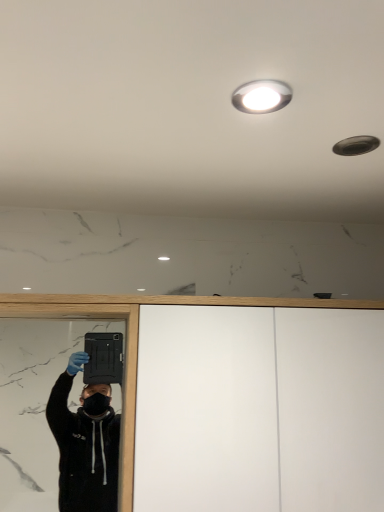
Question: From a real-world perspective, relative to white glossy droplight at upper center, is white matte dresser at center vertically above or below?

Choices:
 (A) above
 (B) below

Answer: (B)

Question: Looking at their shapes, would you say white matte dresser at center is wider or thinner than white glossy droplight at upper center?

Choices:
 (A) thin
 (B) wide

Answer: (B)

Question: Based on their sizes in the image, would you say white matte dresser at center is bigger or smaller than white glossy droplight at upper center?

Choices:
 (A) big
 (B) small

Answer: (A)

Question: From the image's perspective, relative to white matte dresser at center, is white glossy droplight at upper center above or below?

Choices:
 (A) below
 (B) above

Answer: (B)

Question: Which is correct: white glossy droplight at upper center is inside white matte dresser at center, or outside of it?

Choices:
 (A) inside
 (B) outside

Answer: (B)

Question: Based on their sizes in the image, would you say white glossy droplight at upper center is bigger or smaller than white matte dresser at center?

Choices:
 (A) big
 (B) small

Answer: (B)

Question: Based on their positions, is white glossy droplight at upper center located to the left or right of white matte dresser at center?

Choices:
 (A) left
 (B) right

Answer: (A)